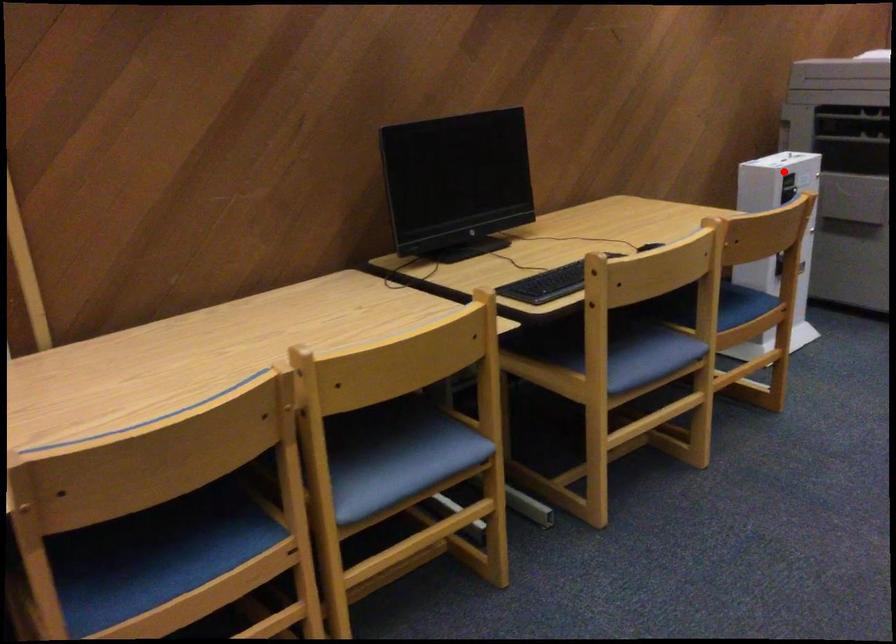
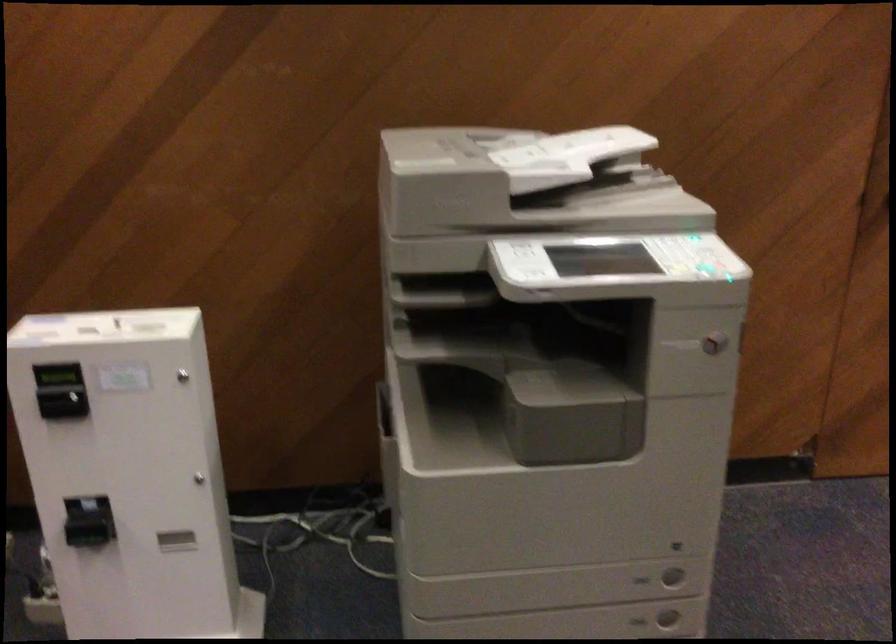
Question: I am providing you with two images of the same scene from different viewpoints. In image1, a red point is highlighted. Considering the same 3D point in image2, which of the following is correct?

Choices:
 (A) It is closer
 (B) It is farther

Answer: (A)